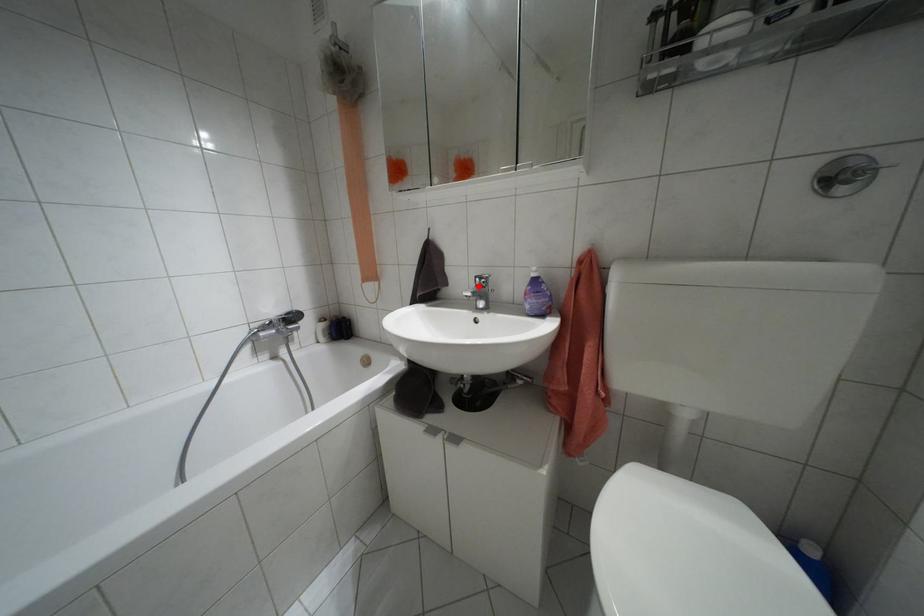
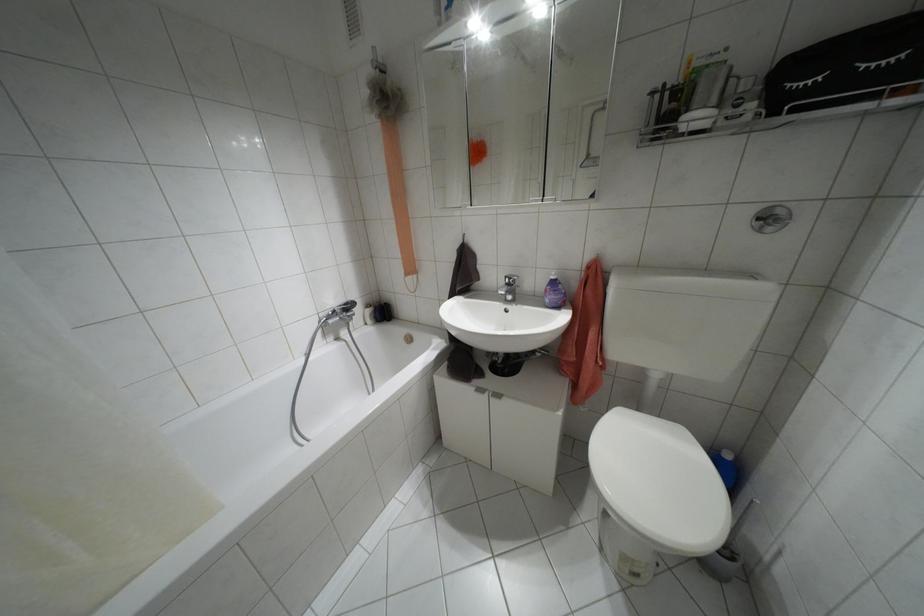
Locate, in the second image, the point that corresponds to the highlighted location in the first image.

(507, 284)